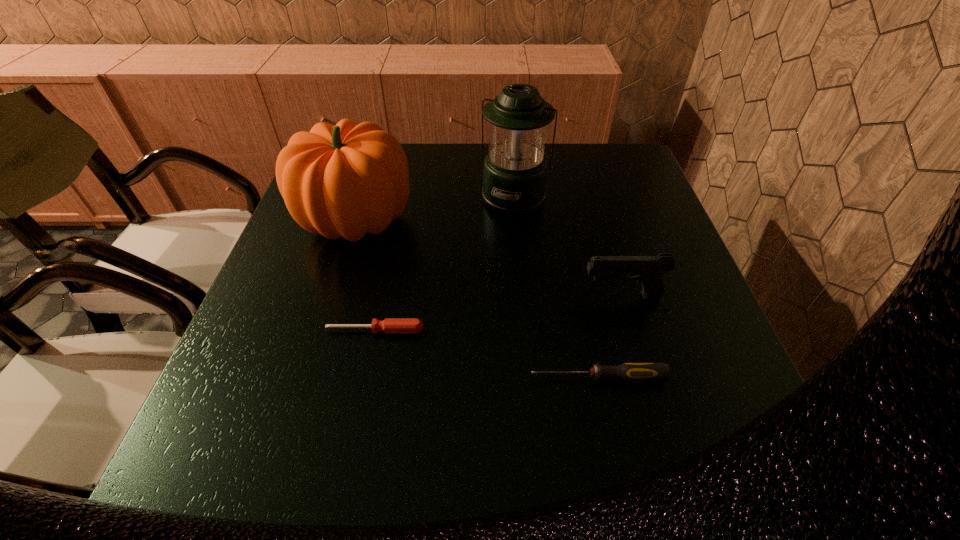
Identify the location of lantern. (514, 178).

The image size is (960, 540). I want to click on pumpkin, so click(347, 180).

The height and width of the screenshot is (540, 960). In order to click on the third farthest object in this screenshot , I will do `click(648, 269)`.

Locate an element on the screen. the third tallest object is located at coordinates (648, 269).

This screenshot has height=540, width=960. In order to click on the second shortest object in this screenshot , I will do `click(629, 372)`.

This screenshot has width=960, height=540. Identify the location of the nearer screwdriver. (629, 372).

You are a GUI agent. You are given a task and a screenshot of the screen. Output one action in this format:
    pyautogui.click(x=<x>, y=<y>)
    Task: Click on the fourth farthest object
    The width and height of the screenshot is (960, 540).
    Given the screenshot: What is the action you would take?
    [x=389, y=326]

At what (x,y) coordinates should I click in order to perform the action: click on the left screwdriver. Please return your answer as a coordinate pair (x, y). Image resolution: width=960 pixels, height=540 pixels. Looking at the image, I should click on (389, 326).

Where is `vacant region located 0.140m on the back of the lantern`? vacant region located 0.140m on the back of the lantern is located at coordinates (511, 152).

The width and height of the screenshot is (960, 540). I want to click on vacant space located 0.110m on the front of the pumpkin, so click(x=333, y=299).